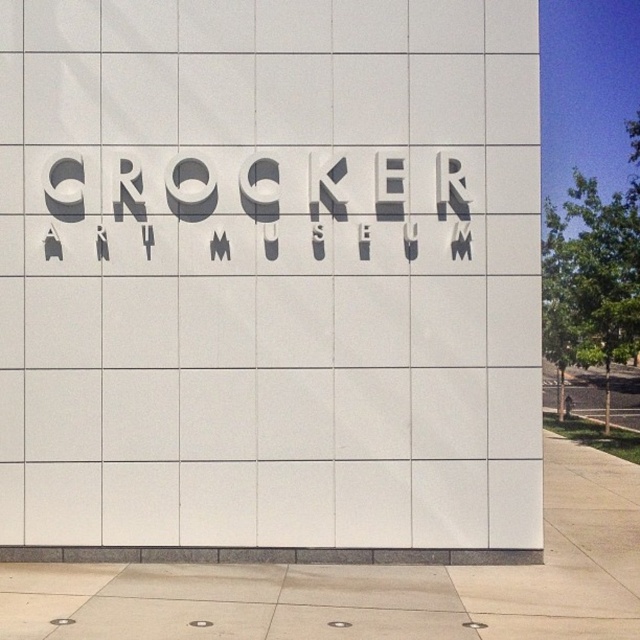
Question: Does white matte sign at center have a greater width compared to gray concrete pavement at lower center?

Choices:
 (A) no
 (B) yes

Answer: (A)

Question: Which object appears farthest from the camera in this image?

Choices:
 (A) gray concrete pavement at lower center
 (B) white matte sign at center

Answer: (B)

Question: Which point appears farthest from the camera in this image?

Choices:
 (A) (186, 573)
 (B) (332, 109)

Answer: (B)

Question: Is white matte sign at center thinner than gray concrete pavement at lower center?

Choices:
 (A) yes
 (B) no

Answer: (A)

Question: Can you confirm if white matte sign at center is smaller than gray concrete pavement at lower center?

Choices:
 (A) yes
 (B) no

Answer: (A)